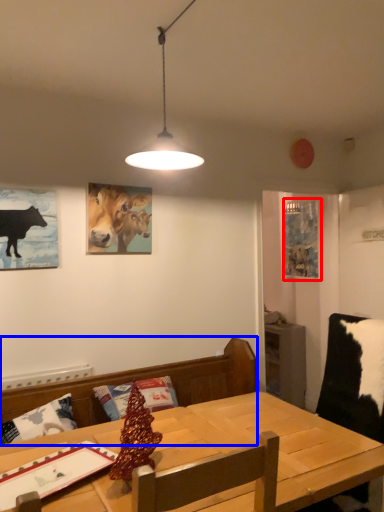
Question: Which object appears farthest to the camera in this image, picture frame (highlighted by a red box) or brown (highlighted by a blue box)?

Choices:
 (A) picture frame
 (B) brown

Answer: (A)